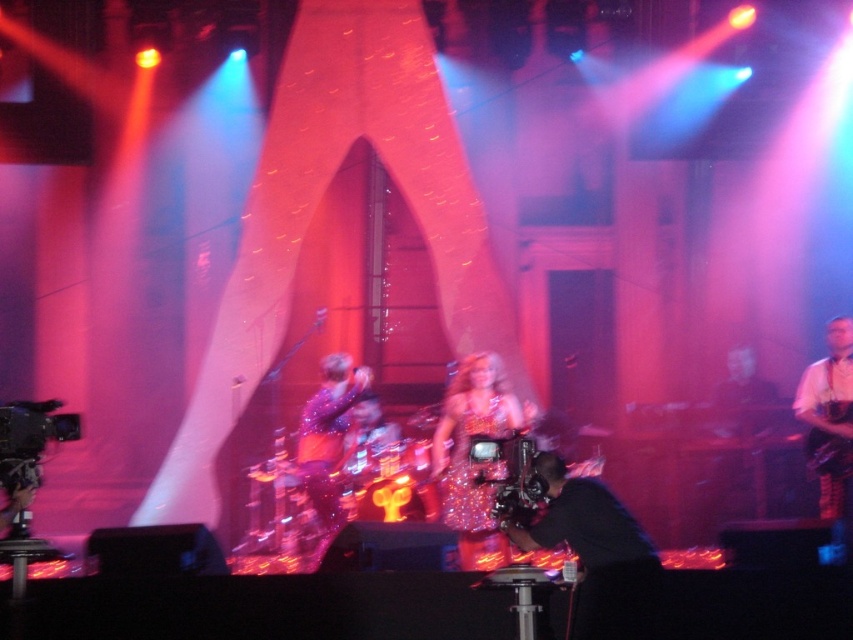
Question: Does white leather guitar at right come behind sparkly purple dress at center?

Choices:
 (A) yes
 (B) no

Answer: (B)

Question: Which is farther from the sparkly purple dress at center?

Choices:
 (A) black matte camera at center
 (B) black glossy guitar at center
 (C) sparkly gold dress at center

Answer: (A)

Question: Which of the following is the closest to the observer?

Choices:
 (A) (532, 547)
 (B) (840, 388)

Answer: (A)

Question: Is sparkly purple dress at center thinner than black glossy guitar at center?

Choices:
 (A) no
 (B) yes

Answer: (B)

Question: Which object is positioned farthest from the sparkly purple dress at center?

Choices:
 (A) black glossy guitar at center
 (B) sparkly gold dress at center
 (C) black matte camera at center
 (D) white leather guitar at right

Answer: (C)

Question: Can you confirm if sparkly gold dress at center is positioned to the right of white leather guitar at right?

Choices:
 (A) yes
 (B) no

Answer: (B)